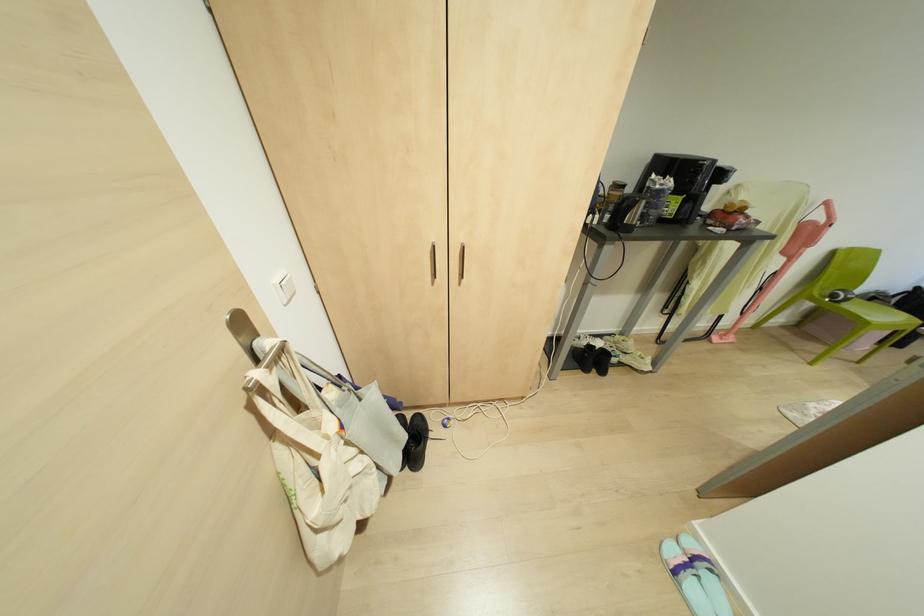
Which object does [416,442] point to?

This point indicates the black shoe.